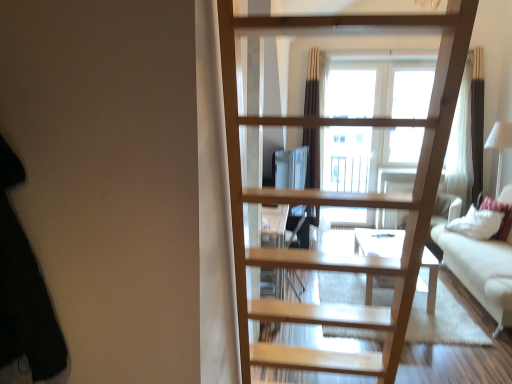
Image resolution: width=512 pixels, height=384 pixels. What do you see at coordinates (481, 270) in the screenshot?
I see `white fabric couch at right` at bounding box center [481, 270].

Find the location of `black fabric at left`. black fabric at left is located at coordinates (24, 289).

Identify the location of natural wood ladder at center. The image size is (512, 384). 342,201.

The width and height of the screenshot is (512, 384). Find the location of `white fabric couch at right`. white fabric couch at right is located at coordinates (481, 270).

From a real-world perspective, is white soft pillow at right physically located above or below natural wood ladder at center?

From a real-world perspective, white soft pillow at right is physically below natural wood ladder at center.

From their relative heights in the image, would you say white soft pillow at right is taller or shorter than natural wood ladder at center?

Considering their sizes, white soft pillow at right has less height than natural wood ladder at center.

Which of these two, white soft pillow at right or natural wood ladder at center, is thinner?

white soft pillow at right.

Who is shorter, white fabric couch at right or black fabric at left?

Standing shorter between the two is white fabric couch at right.

Does white fabric couch at right appear on the left side of black fabric at left?

In fact, white fabric couch at right is to the right of black fabric at left.

Is white fabric couch at right directly adjacent to black fabric at left?

No, white fabric couch at right is not beside black fabric at left.

What's the angular difference between white fabric couch at right and black fabric at left's facing directions?

The facing directions of white fabric couch at right and black fabric at left are 90.7 degrees apart.

Looking at the image, does white fabric couch at right seem bigger or smaller compared to white soft pillow at right?

Clearly, white fabric couch at right is larger in size than white soft pillow at right.

From the image's perspective, is white fabric couch at right under white soft pillow at right?

Yes, from the image's perspective, white fabric couch at right is below white soft pillow at right.

Does white fabric couch at right touch white soft pillow at right?

No, white fabric couch at right is not beside white soft pillow at right.

Between white fabric couch at right and white soft pillow at right, which one has smaller width?

white soft pillow at right.

From a real-world perspective, is white fabric couch at right positioned above or below natural wood ladder at center?

In terms of real-world spatial position, white fabric couch at right is below natural wood ladder at center.

From their relative heights in the image, would you say white fabric couch at right is taller or shorter than natural wood ladder at center?

white fabric couch at right is shorter than natural wood ladder at center.

Which is more distant, (505, 279) or (233, 101)?

The point (505, 279) is farther from the camera.

Is black fabric at left in front of or behind white fabric couch at right in the image?

black fabric at left is positioned closer to the viewer than white fabric couch at right.

From the image's perspective, is black fabric at left above white fabric couch at right?

Yes, from the image's perspective, black fabric at left is above white fabric couch at right.

Where is `dark above the white fabric couch at right (from a real-world perspective)`? This screenshot has width=512, height=384. dark above the white fabric couch at right (from a real-world perspective) is located at coordinates (24, 289).

Is black fabric at left aimed at white fabric couch at right?

No, black fabric at left is not facing towards white fabric couch at right.

Considering their positions, is black fabric at left located in front of or behind natural wood ladder at center?

black fabric at left is positioned closer to the viewer than natural wood ladder at center.

In the scene shown: Does black fabric at left turn towards natural wood ladder at center?

No, black fabric at left is not aimed at natural wood ladder at center.

The height and width of the screenshot is (384, 512). Find the location of `ladder on the right of black fabric at left`. ladder on the right of black fabric at left is located at coordinates (342, 201).

Would you say black fabric at left is to the left or to the right of natural wood ladder at center in the picture?

black fabric at left is to the left of natural wood ladder at center.

From the image's perspective, is white soft pillow at right positioned above or below black fabric at left?

Clearly, from the image's perspective, white soft pillow at right is below black fabric at left.

Can you confirm if white soft pillow at right is positioned to the right of black fabric at left?

Indeed, white soft pillow at right is positioned on the right side of black fabric at left.

From a real-world perspective, is white soft pillow at right physically located above or below black fabric at left?

In terms of real-world spatial position, white soft pillow at right is below black fabric at left.

Locate an element on the screen. The width and height of the screenshot is (512, 384). ladder above the white soft pillow at right (from the image's perspective) is located at coordinates (342, 201).

Identify the location of studio couch below the black fabric at left (from a real-world perspective). The height and width of the screenshot is (384, 512). (481, 270).

Estimate the real-world distances between objects in this image. Which object is closer to natural wood ladder at center, black fabric at left or white soft pillow at right?

black fabric at left is closer to natural wood ladder at center.

When comparing their distances from natural wood ladder at center, does white soft pillow at right or white fabric couch at right seem further?

white soft pillow at right is positioned further to the anchor natural wood ladder at center.

Looking at the image, which one is located further to black fabric at left, white fabric couch at right or natural wood ladder at center?

white fabric couch at right.

From the image, which object appears to be farther from black fabric at left, natural wood ladder at center or white fabric couch at right?

white fabric couch at right is further to black fabric at left.

Considering their positions, is white fabric couch at right positioned closer to natural wood ladder at center than black fabric at left?

black fabric at left lies closer to natural wood ladder at center than the other object.

From the image, which object appears to be nearer to white soft pillow at right, white fabric couch at right or natural wood ladder at center?

white fabric couch at right is closer to white soft pillow at right.

Based on their spatial positions, is white soft pillow at right or black fabric at left further from white fabric couch at right?

The object further to white fabric couch at right is black fabric at left.

Considering their positions, is natural wood ladder at center positioned further to white fabric couch at right than white soft pillow at right?

natural wood ladder at center lies further to white fabric couch at right than the other object.

Where is `ladder located between black fabric at left and white soft pillow at right in the depth direction`? ladder located between black fabric at left and white soft pillow at right in the depth direction is located at coordinates (342, 201).

Locate an element on the screen. The width and height of the screenshot is (512, 384). ladder between black fabric at left and white fabric couch at right is located at coordinates (342, 201).

Locate an element on the screen. studio couch between black fabric at left and white soft pillow at right is located at coordinates (481, 270).

At what (x,y) coordinates should I click in order to perform the action: click on studio couch positioned between natural wood ladder at center and white soft pillow at right from near to far. Please return your answer as a coordinate pair (x, y). The image size is (512, 384). Looking at the image, I should click on (481, 270).